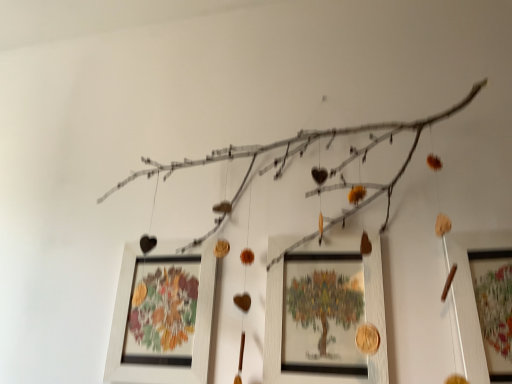
This screenshot has height=384, width=512. I want to click on wooden frame at center, which appears as the first picture frame when viewed from the left, so click(162, 316).

What are the coordinates of `wooden picture frame at right, which is counted as the 1th picture frame, starting from the right` in the screenshot? It's located at (483, 303).

How much space does wooden picture frame at right, which is counted as the 1th picture frame, starting from the right, occupy vertically?

15.59 inches.

The width and height of the screenshot is (512, 384). I want to click on wooden framed picture at center, marked as the 2th picture frame in a left-to-right arrangement, so click(325, 314).

Looking at this image, considering the relative sizes of wooden picture frame at right, arranged as the third picture frame when viewed from the left, and wooden frame at center, which appears as the first picture frame when viewed from the left, in the image provided, is wooden picture frame at right, arranged as the third picture frame when viewed from the left, taller than wooden frame at center, which appears as the first picture frame when viewed from the left,?

Correct, wooden picture frame at right, arranged as the third picture frame when viewed from the left, is much taller as wooden frame at center, which appears as the first picture frame when viewed from the left.

From the image's perspective, is wooden picture frame at right, which is counted as the 1th picture frame, starting from the right, located above wooden frame at center, which appears as the first picture frame when viewed from the left?

Yes, from the image's perspective, wooden picture frame at right, which is counted as the 1th picture frame, starting from the right, is above wooden frame at center, which appears as the first picture frame when viewed from the left.

Which object is wider, wooden picture frame at right, arranged as the third picture frame when viewed from the left, or wooden frame at center, the third picture frame positioned from the right?

With larger width is wooden picture frame at right, arranged as the third picture frame when viewed from the left.

From the image's perspective, count 2nd picture frames upward from the wooden frame at center, which appears as the first picture frame when viewed from the left, and point to it. Please provide its 2D coordinates.

[(483, 303)]

Is point (146, 357) closer to camera compared to point (377, 266)?

No, it is behind (377, 266).

From the image's perspective, is wooden frame at center, which appears as the first picture frame when viewed from the left, under wooden framed picture at center, the second picture frame viewed from the right?

Indeed, from the image's perspective, wooden frame at center, which appears as the first picture frame when viewed from the left, is shown beneath wooden framed picture at center, the second picture frame viewed from the right.

Considering the sizes of objects wooden frame at center, which appears as the first picture frame when viewed from the left, and wooden framed picture at center, marked as the 2th picture frame in a left-to-right arrangement, in the image provided, who is smaller, wooden frame at center, which appears as the first picture frame when viewed from the left, or wooden framed picture at center, marked as the 2th picture frame in a left-to-right arrangement,?

wooden framed picture at center, marked as the 2th picture frame in a left-to-right arrangement, is smaller.

Is the position of wooden frame at center, which appears as the first picture frame when viewed from the left, less distant than that of wooden framed picture at center, the second picture frame viewed from the right?

No, wooden frame at center, which appears as the first picture frame when viewed from the left, is further to the viewer.

Which is more to the right, wooden framed picture at center, the second picture frame viewed from the right, or wooden picture frame at right, arranged as the third picture frame when viewed from the left?

wooden picture frame at right, arranged as the third picture frame when viewed from the left, is more to the right.

Which is closer to the camera, (315, 362) or (493, 305)?

Point (315, 362) is farther from the camera than point (493, 305).

Is wooden framed picture at center, the second picture frame viewed from the right, with wooden picture frame at right, arranged as the third picture frame when viewed from the left?

No, wooden framed picture at center, the second picture frame viewed from the right, is not touching wooden picture frame at right, arranged as the third picture frame when viewed from the left.

Consider the image. From a real-world perspective, who is located lower, wooden framed picture at center, the second picture frame viewed from the right, or wooden picture frame at right, which is counted as the 1th picture frame, starting from the right?

wooden framed picture at center, the second picture frame viewed from the right, is physically lower.

Considering the sizes of objects wooden framed picture at center, the second picture frame viewed from the right, and wooden frame at center, the third picture frame positioned from the right, in the image provided, who is wider, wooden framed picture at center, the second picture frame viewed from the right, or wooden frame at center, the third picture frame positioned from the right,?

wooden frame at center, the third picture frame positioned from the right, is wider.

Can we say wooden framed picture at center, the second picture frame viewed from the right, lies outside wooden frame at center, which appears as the first picture frame when viewed from the left?

That's correct, wooden framed picture at center, the second picture frame viewed from the right, is outside of wooden frame at center, which appears as the first picture frame when viewed from the left.

Does wooden framed picture at center, marked as the 2th picture frame in a left-to-right arrangement, have a larger size compared to wooden frame at center, which appears as the first picture frame when viewed from the left?

Incorrect, wooden framed picture at center, marked as the 2th picture frame in a left-to-right arrangement, is not larger than wooden frame at center, which appears as the first picture frame when viewed from the left.

Is wooden frame at center, which appears as the first picture frame when viewed from the left, looking in the opposite direction of wooden picture frame at right, which is counted as the 1th picture frame, starting from the right?

No, wooden picture frame at right, which is counted as the 1th picture frame, starting from the right, is not at the back of wooden frame at center, which appears as the first picture frame when viewed from the left.

Considering the sizes of objects wooden frame at center, the third picture frame positioned from the right, and wooden picture frame at right, which is counted as the 1th picture frame, starting from the right, in the image provided, who is taller, wooden frame at center, the third picture frame positioned from the right, or wooden picture frame at right, which is counted as the 1th picture frame, starting from the right,?

wooden picture frame at right, which is counted as the 1th picture frame, starting from the right.

Is point (211, 250) closer to viewer compared to point (471, 335)?

No, it is not.

Is wooden picture frame at right, arranged as the third picture frame when viewed from the left, looking in the opposite direction of wooden framed picture at center, the second picture frame viewed from the right?

No.

How distant is wooden picture frame at right, arranged as the third picture frame when viewed from the left, from wooden framed picture at center, marked as the 2th picture frame in a left-to-right arrangement?

The distance of wooden picture frame at right, arranged as the third picture frame when viewed from the left, from wooden framed picture at center, marked as the 2th picture frame in a left-to-right arrangement, is 10.75 inches.

From the image's perspective, which one is positioned lower, wooden picture frame at right, which is counted as the 1th picture frame, starting from the right, or wooden framed picture at center, the second picture frame viewed from the right?

wooden framed picture at center, the second picture frame viewed from the right, is shown below in the image.

Is wooden picture frame at right, which is counted as the 1th picture frame, starting from the right, taller than wooden framed picture at center, the second picture frame viewed from the right?

Yes, wooden picture frame at right, which is counted as the 1th picture frame, starting from the right, is taller than wooden framed picture at center, the second picture frame viewed from the right.

You are a GUI agent. You are given a task and a screenshot of the screen. Output one action in this format:
    pyautogui.click(x=<x>, y=<y>)
    Task: Click on the picture frame that is the 2nd one when counting rightward from the wooden frame at center, the third picture frame positioned from the right
    The width and height of the screenshot is (512, 384).
    Given the screenshot: What is the action you would take?
    pyautogui.click(x=483, y=303)

What are the coordinates of `picture frame on the left of wooden framed picture at center, marked as the 2th picture frame in a left-to-right arrangement` in the screenshot? It's located at (162, 316).

Estimate the real-world distances between objects in this image. Which object is closer to wooden framed picture at center, the second picture frame viewed from the right, wooden picture frame at right, which is counted as the 1th picture frame, starting from the right, or wooden frame at center, which appears as the first picture frame when viewed from the left?

The object closer to wooden framed picture at center, the second picture frame viewed from the right, is wooden picture frame at right, which is counted as the 1th picture frame, starting from the right.

Based on their spatial positions, is wooden framed picture at center, the second picture frame viewed from the right, or wooden picture frame at right, arranged as the third picture frame when viewed from the left, further from wooden frame at center, which appears as the first picture frame when viewed from the left?

wooden picture frame at right, arranged as the third picture frame when viewed from the left, lies further to wooden frame at center, which appears as the first picture frame when viewed from the left, than the other object.

Which object lies further to the anchor point wooden picture frame at right, which is counted as the 1th picture frame, starting from the right, wooden framed picture at center, the second picture frame viewed from the right, or wooden frame at center, the third picture frame positioned from the right?

Among the two, wooden frame at center, the third picture frame positioned from the right, is located further to wooden picture frame at right, which is counted as the 1th picture frame, starting from the right.

In the scene shown: Which object lies nearer to the anchor point wooden frame at center, which appears as the first picture frame when viewed from the left, wooden picture frame at right, arranged as the third picture frame when viewed from the left, or wooden framed picture at center, the second picture frame viewed from the right?

wooden framed picture at center, the second picture frame viewed from the right, is positioned closer to the anchor wooden frame at center, which appears as the first picture frame when viewed from the left.

Which object lies nearer to the anchor point wooden picture frame at right, arranged as the third picture frame when viewed from the left, wooden frame at center, which appears as the first picture frame when viewed from the left, or wooden framed picture at center, marked as the 2th picture frame in a left-to-right arrangement?

wooden framed picture at center, marked as the 2th picture frame in a left-to-right arrangement.

Based on their spatial positions, is wooden frame at center, the third picture frame positioned from the right, or wooden picture frame at right, which is counted as the 1th picture frame, starting from the right, closer to wooden framed picture at center, the second picture frame viewed from the right?

wooden picture frame at right, which is counted as the 1th picture frame, starting from the right, is closer to wooden framed picture at center, the second picture frame viewed from the right.

The width and height of the screenshot is (512, 384). Identify the location of picture frame situated between wooden frame at center, the third picture frame positioned from the right, and wooden picture frame at right, which is counted as the 1th picture frame, starting from the right, from left to right. (325, 314).